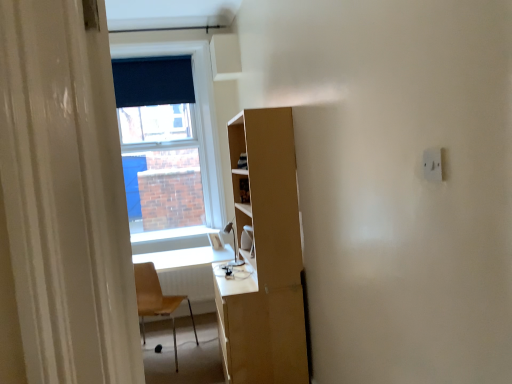
Question: In terms of height, does white plastic electric outlet at upper right look taller or shorter compared to dark blue fabric at upper center?

Choices:
 (A) tall
 (B) short

Answer: (B)

Question: Considering the relative positions of white plastic electric outlet at upper right and dark blue fabric at upper center in the image provided, is white plastic electric outlet at upper right to the left or to the right of dark blue fabric at upper center?

Choices:
 (A) right
 (B) left

Answer: (A)

Question: Estimate the real-world distances between objects in this image. Which object is farther from the dark blue fabric at upper center?

Choices:
 (A) white plastic electric outlet at upper right
 (B) light brown plastic chair at lower left
 (C) white glossy window sill at center
 (D) white glossy computer desk at center

Answer: (A)

Question: Based on their relative distances, which object is nearer to the white plastic electric outlet at upper right?

Choices:
 (A) white glossy computer desk at center
 (B) dark blue fabric at upper center
 (C) white glossy window sill at center
 (D) light brown plastic chair at lower left

Answer: (D)